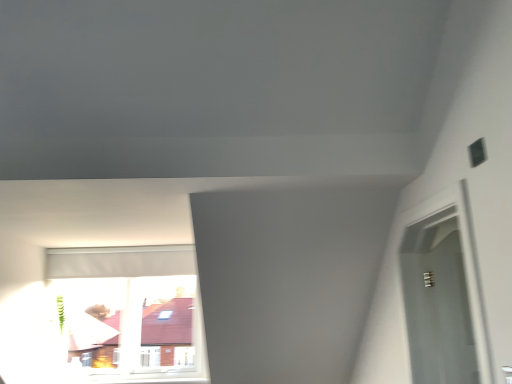
What is the approximate width of silver metallic screen door at right?

2.43 inches.

Locate an element on the screen. silver metallic screen door at right is located at coordinates tap(440, 303).

Describe the element at coordinates (440, 303) in the screenshot. I see `silver metallic screen door at right` at that location.

I want to click on silver metallic screen door at right, so click(440, 303).